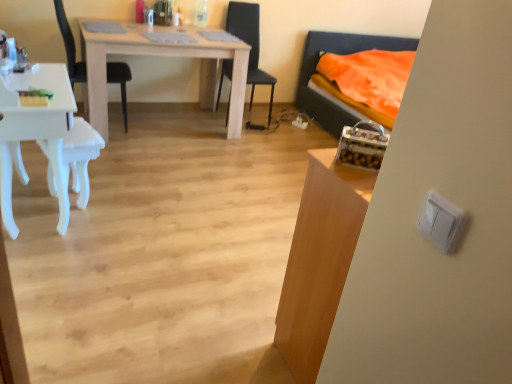
In order to click on free space to the right of white glossy desk at left in this screenshot , I will do `click(136, 223)`.